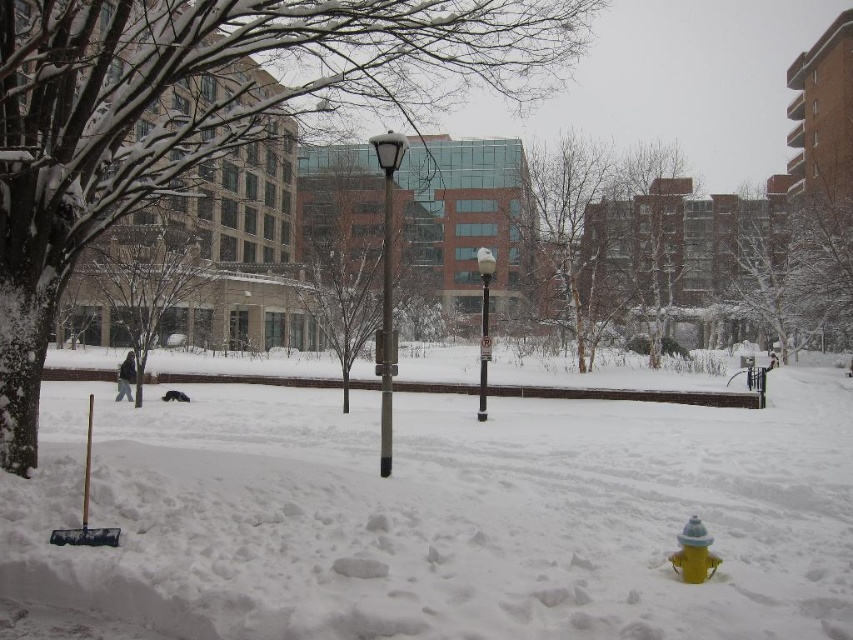
Question: Which object is farther from the camera taking this photo?

Choices:
 (A) metallic gray pole at center
 (B) black plastic pole at center
 (C) white glossy lamp post at center

Answer: (B)

Question: Which point appears closest to the camera in this image?

Choices:
 (A) (630, 248)
 (B) (392, 244)
 (C) (814, 371)

Answer: (B)

Question: Can you confirm if satin black lamp post at center is positioned below wooden shovel at lower left?

Choices:
 (A) no
 (B) yes

Answer: (A)

Question: Which of these objects is positioned farthest from the white glossy lamp post at center?

Choices:
 (A) white fluffy snow at lower center
 (B) brown textured tree at center
 (C) bare branches at center
 (D) snow-covered tree at center

Answer: (C)

Question: From the image, what is the correct spatial relationship of satin black lamp post at center in relation to metallic gray pole at center?

Choices:
 (A) above
 (B) below

Answer: (A)

Question: Is brown textured tree at center in front of white glossy lamp post at center?

Choices:
 (A) yes
 (B) no

Answer: (A)